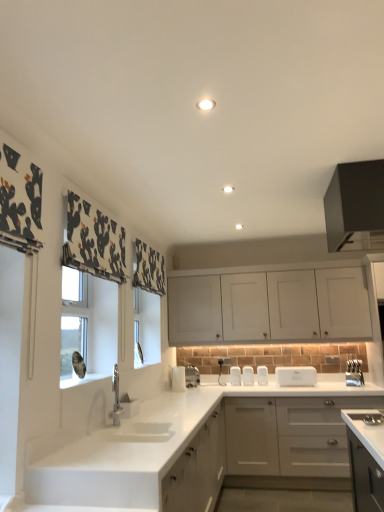
Question: Is satin nickel faucet at center, the second appliance viewed from the left, placed right next to white glossy toaster at lower center, the 1th appliance in the left-to-right sequence?

Choices:
 (A) no
 (B) yes

Answer: (B)

Question: Is satin nickel faucet at center, the sixth appliance in the right-to-left sequence, outside white glossy toaster at lower center, the seventh appliance positioned from the right?

Choices:
 (A) yes
 (B) no

Answer: (A)

Question: Is satin nickel faucet at center, the second appliance viewed from the left, positioned behind white glossy toaster at lower center, the 1th appliance in the left-to-right sequence?

Choices:
 (A) yes
 (B) no

Answer: (A)

Question: From the image's perspective, would you say satin nickel faucet at center, the sixth appliance in the right-to-left sequence, is shown under white glossy toaster at lower center, the 1th appliance in the left-to-right sequence?

Choices:
 (A) yes
 (B) no

Answer: (A)

Question: Is satin nickel faucet at center, the second appliance viewed from the left, taller than white glossy toaster at lower center, the seventh appliance positioned from the right?

Choices:
 (A) no
 (B) yes

Answer: (A)

Question: Is satin nickel faucet at center, the sixth appliance in the right-to-left sequence, at the left side of white glossy toaster at lower center, the 1th appliance in the left-to-right sequence?

Choices:
 (A) no
 (B) yes

Answer: (A)

Question: Is white matte cabinet at lower left, the 1th cabinetry positioned from the bottom, oriented away from white plastic toaster at center, marked as the sixth appliance in a left-to-right arrangement?

Choices:
 (A) no
 (B) yes

Answer: (A)

Question: Is white matte cabinet at lower left, the 3th cabinetry when ordered from top to bottom, shorter than white plastic toaster at center, marked as the sixth appliance in a left-to-right arrangement?

Choices:
 (A) yes
 (B) no

Answer: (B)

Question: From a real-world perspective, is white matte cabinet at lower left, the 1th cabinetry positioned from the bottom, positioned over white plastic toaster at center, marked as the sixth appliance in a left-to-right arrangement, based on gravity?

Choices:
 (A) no
 (B) yes

Answer: (A)

Question: Are white matte cabinet at lower left, the 3th cabinetry when ordered from top to bottom, and white plastic toaster at center, marked as the sixth appliance in a left-to-right arrangement, located far from each other?

Choices:
 (A) no
 (B) yes

Answer: (A)

Question: Is white matte cabinet at lower left, the 1th cabinetry positioned from the bottom, not within white plastic toaster at center, marked as the sixth appliance in a left-to-right arrangement?

Choices:
 (A) no
 (B) yes

Answer: (B)

Question: Is white matte cabinet at lower left, the 3th cabinetry when ordered from top to bottom, positioned before white plastic toaster at center, marked as the sixth appliance in a left-to-right arrangement?

Choices:
 (A) yes
 (B) no

Answer: (A)

Question: Is black matte cabinet at upper right, the third cabinetry when ordered from bottom to top, wider than white matte cabinet at upper center, marked as the second cabinetry in a top-to-bottom arrangement?

Choices:
 (A) no
 (B) yes

Answer: (B)